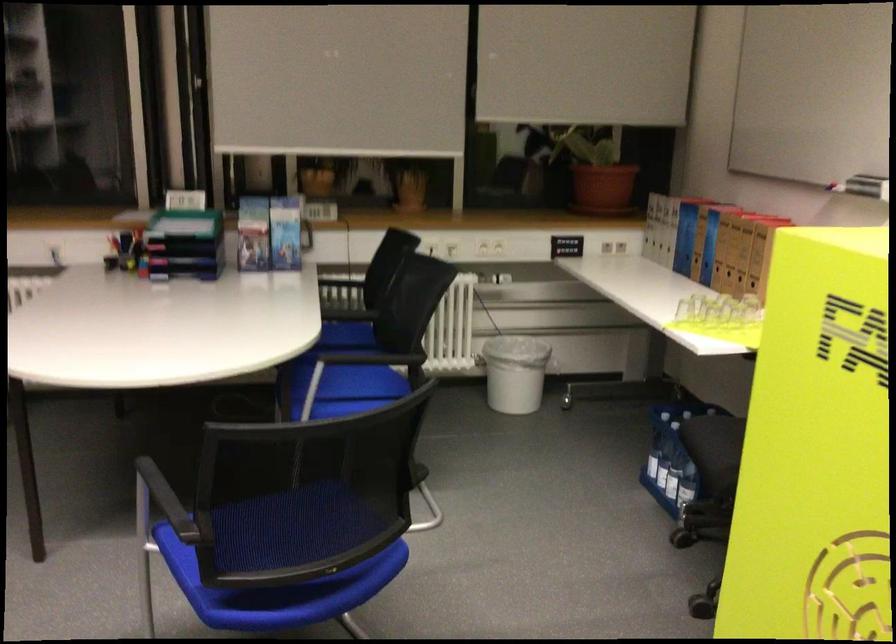
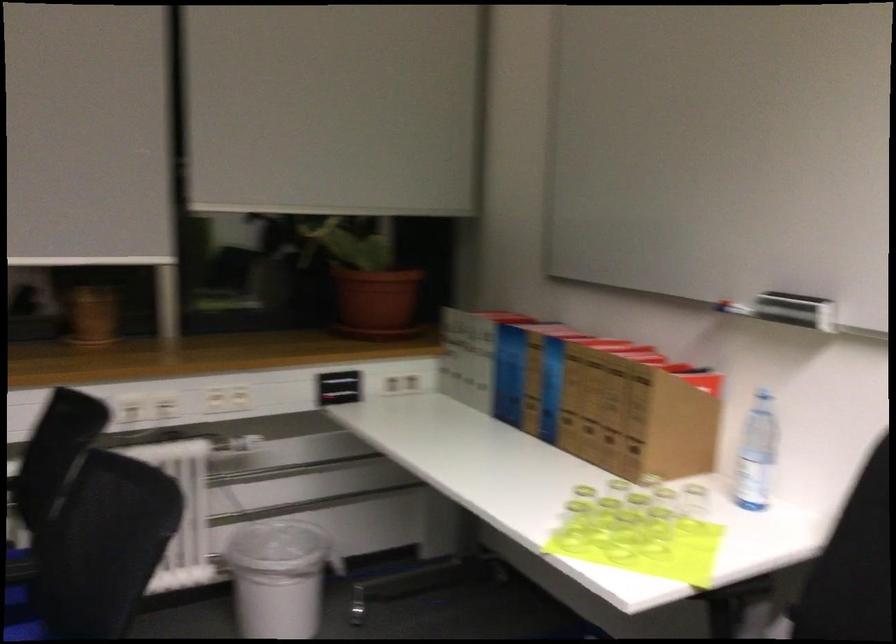
Question: What movement of the cameraman would produce the second image?

Choices:
 (A) Left
 (B) Right
 (C) Forward
 (D) Backward

Answer: (C)